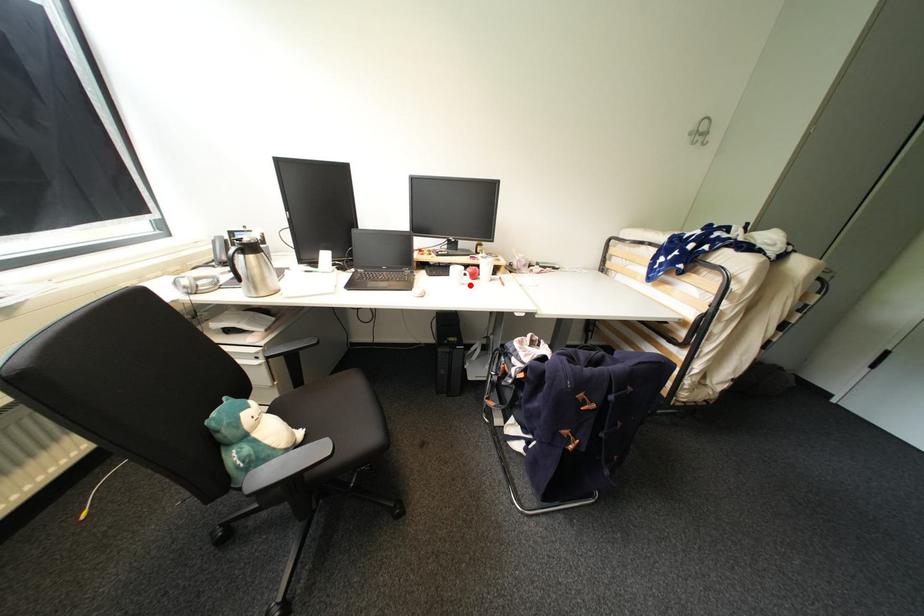
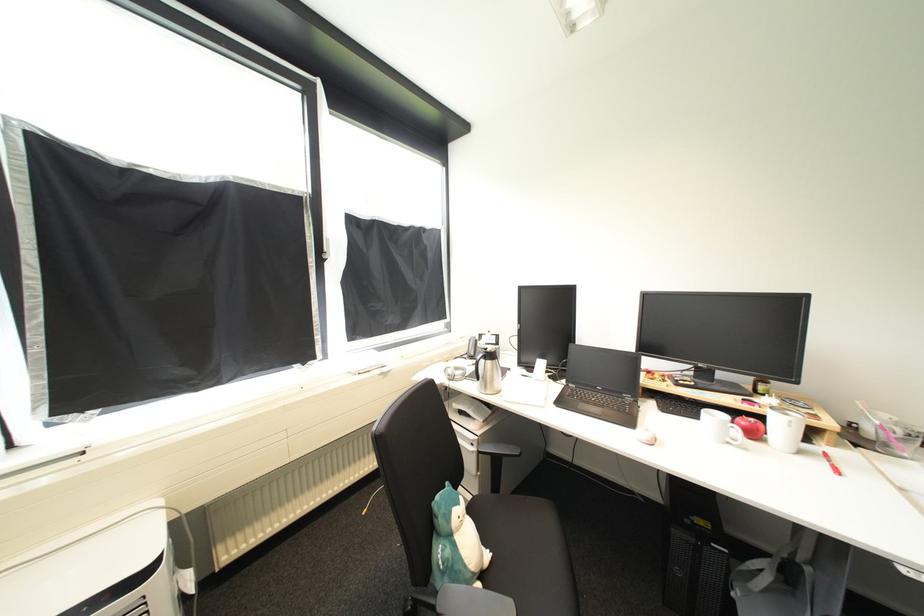
In the second image, find the point that corresponds to the highlighted location in the first image.

(736, 445)